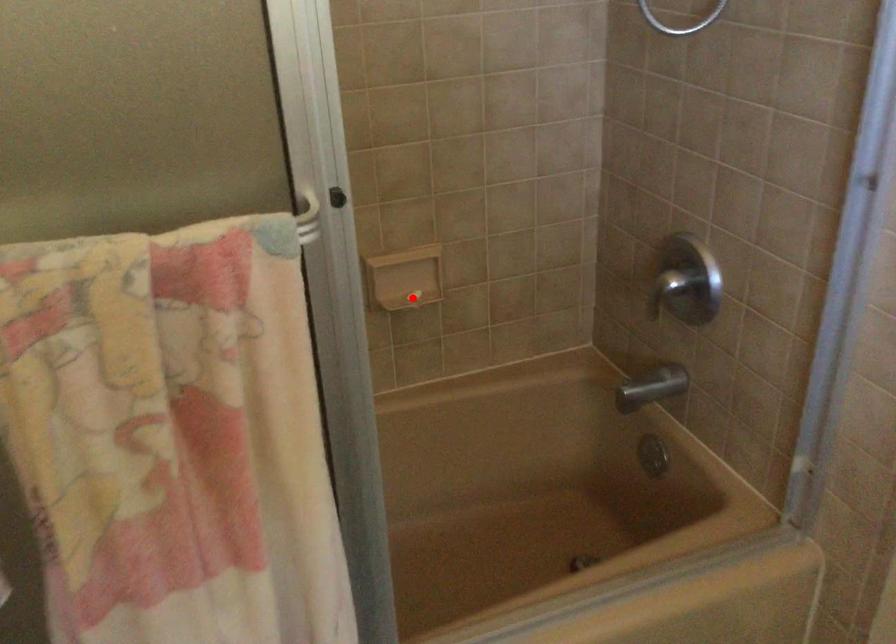
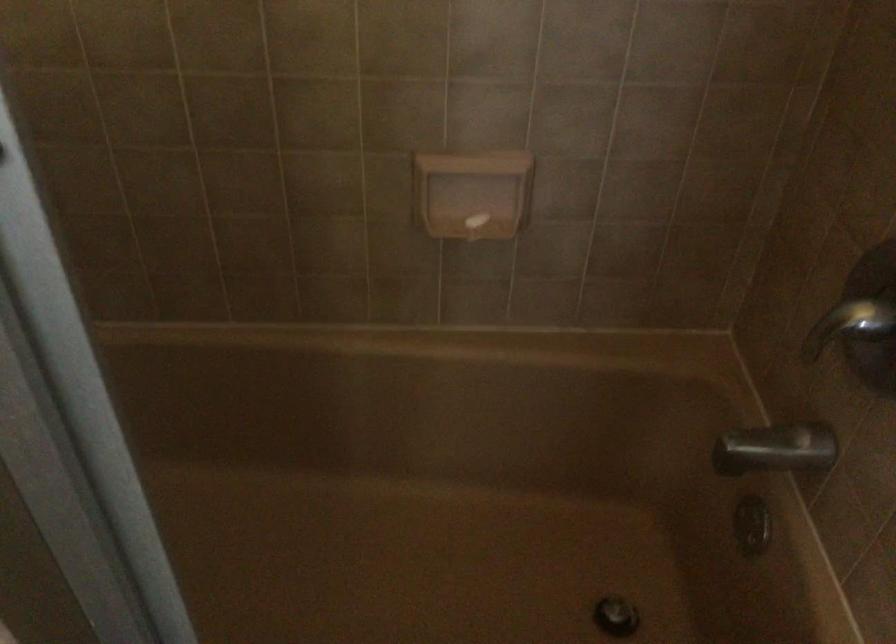
Question: I am providing you with two images of the same scene from different viewpoints. A red point is marked on the first image. Is the red point's position out of view in image 2?

Choices:
 (A) Yes
 (B) No

Answer: (B)